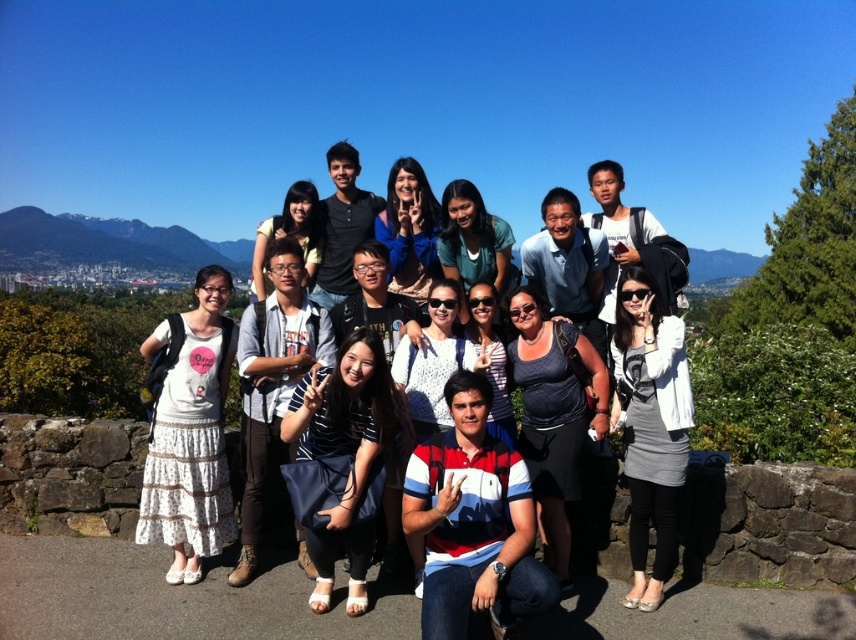
Where is the gray fabric dress at center located in the image?

The gray fabric dress at center is located at point 0.667 on the x axis and 0.761 on the y axis.

You are a photographer standing at the camera position. You want to ensure that the striped fabric dress at center is in focus. If your camera has a depth of field of 15 feet, will the entire group be in focus?

The distance between the striped fabric dress at center and the camera is 20.77 feet. Since the depth of field is only 15 feet, the entire group might not be in focus because the dress is beyond the depth of field range.